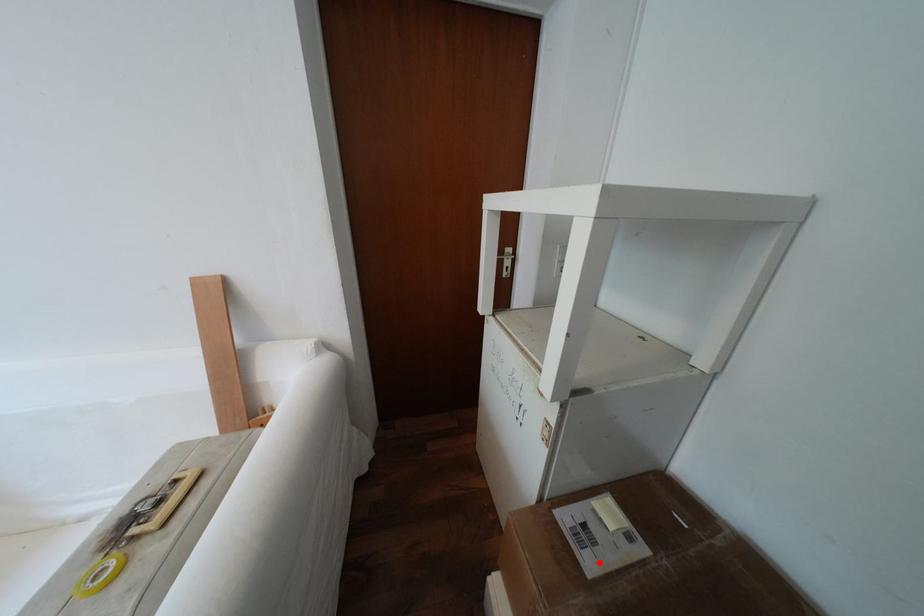
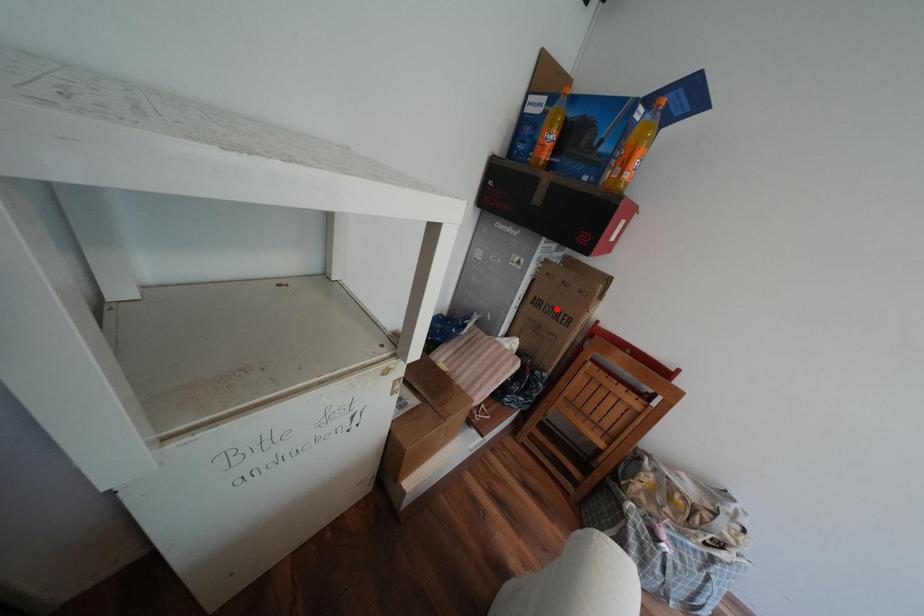
In the scene shown: I am providing you with two images of the same scene from different viewpoints. A red point is marked on the first image and another point is marked on the second image. Is the marked point in image1 the same physical position as the marked point in image2?

No